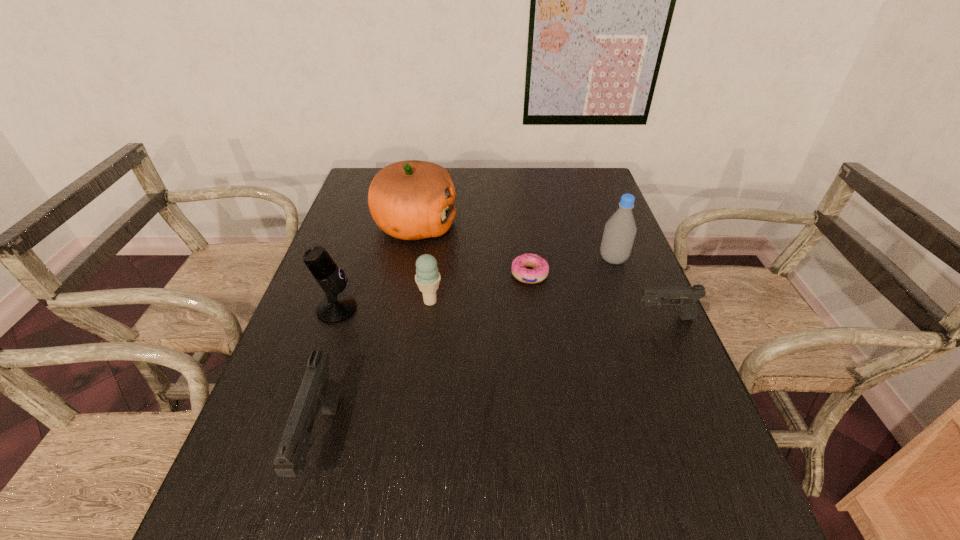
Locate an element on the screen. the nearest object is located at coordinates (318, 391).

I want to click on the nearer pistol, so click(318, 391).

This screenshot has width=960, height=540. Find the location of `the second shortest object`. the second shortest object is located at coordinates (685, 297).

I want to click on the farther pistol, so [x=685, y=297].

At what (x,y) coordinates should I click in order to perform the action: click on pumpkin. Please return your answer as a coordinate pair (x, y). This screenshot has width=960, height=540. Looking at the image, I should click on (410, 200).

Where is `the shortest object`? the shortest object is located at coordinates (519, 269).

You are a GUI agent. You are given a task and a screenshot of the screen. Output one action in this format:
    pyautogui.click(x=<x>, y=<y>)
    Task: Click on the fifth object from left to right
    
    Given the screenshot: What is the action you would take?
    (519, 269)

Image resolution: width=960 pixels, height=540 pixels. I want to click on microphone, so click(335, 308).

Identify the location of ice cream. (427, 277).

The width and height of the screenshot is (960, 540). Find the location of `bottle`. bottle is located at coordinates (620, 230).